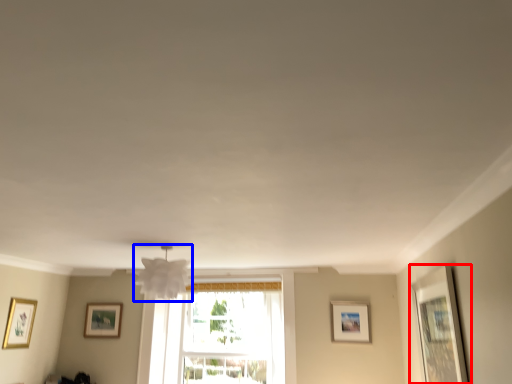
Question: Which point is closer to the camera, picture frame (highlighted by a red box) or lamp (highlighted by a blue box)?

Choices:
 (A) picture frame
 (B) lamp

Answer: (A)